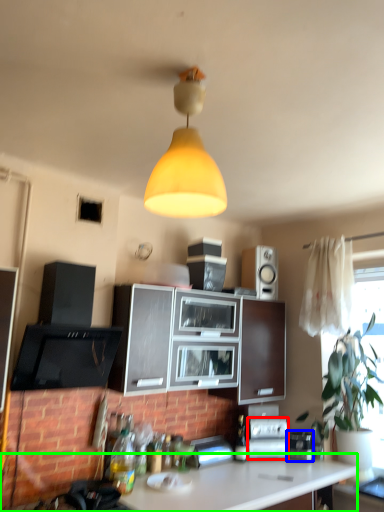
Question: Which object is positioned farthest from appliance (highlighted by a red box)? Select from appliance (highlighted by a blue box) and countertop (highlighted by a green box).

Choices:
 (A) appliance
 (B) countertop

Answer: (B)